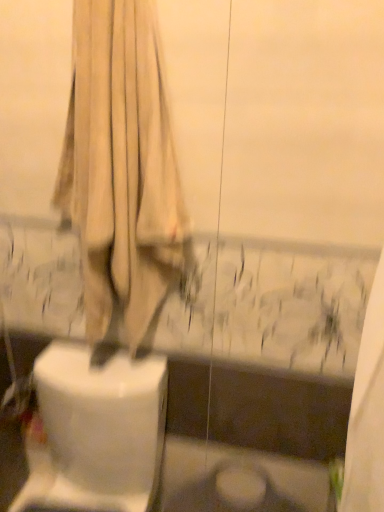
Question: From the image's perspective, is white glossy toilet at lower left positioned above or below beige fabric curtain at upper center?

Choices:
 (A) above
 (B) below

Answer: (B)

Question: Is white glossy toilet at lower left taller or shorter than beige fabric curtain at upper center?

Choices:
 (A) tall
 (B) short

Answer: (B)

Question: From a real-world perspective, is white glossy toilet at lower left positioned above or below beige fabric curtain at upper center?

Choices:
 (A) below
 (B) above

Answer: (A)

Question: From a real-world perspective, is beige fabric curtain at upper center positioned above or below white glossy toilet at lower left?

Choices:
 (A) below
 (B) above

Answer: (B)

Question: From their relative heights in the image, would you say beige fabric curtain at upper center is taller or shorter than white glossy toilet at lower left?

Choices:
 (A) short
 (B) tall

Answer: (B)

Question: In terms of width, does beige fabric curtain at upper center look wider or thinner when compared to white glossy toilet at lower left?

Choices:
 (A) wide
 (B) thin

Answer: (B)

Question: From the image's perspective, is beige fabric curtain at upper center positioned above or below white glossy toilet at lower left?

Choices:
 (A) below
 (B) above

Answer: (B)